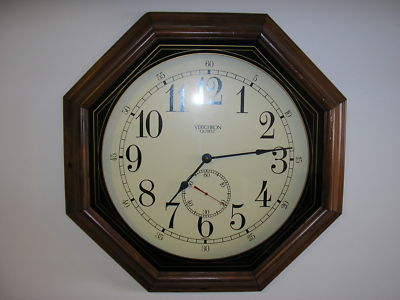
At what (x,y) coordinates should I click in order to perform the action: click on clock. Please return your answer as a coordinate pair (x, y). Looking at the image, I should click on (197, 134).